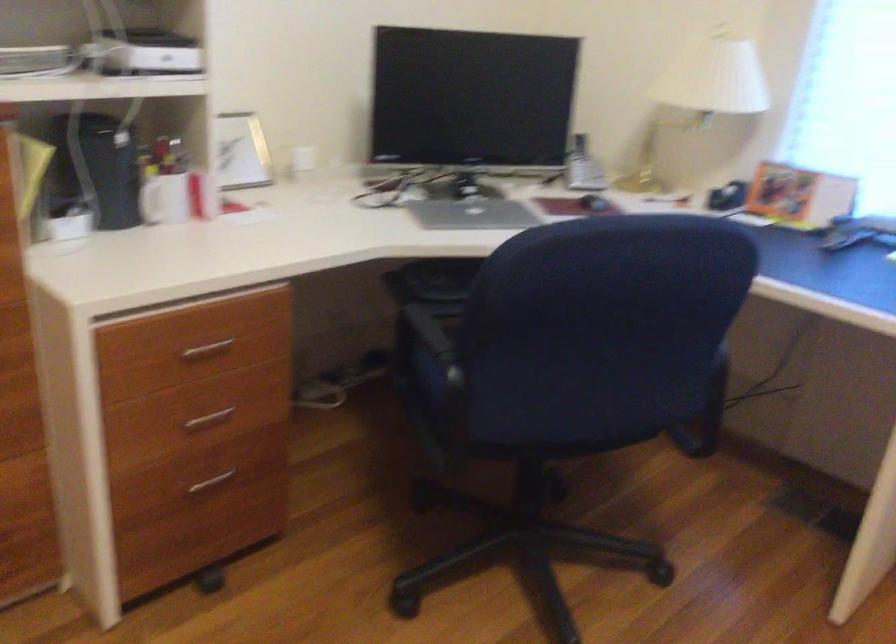
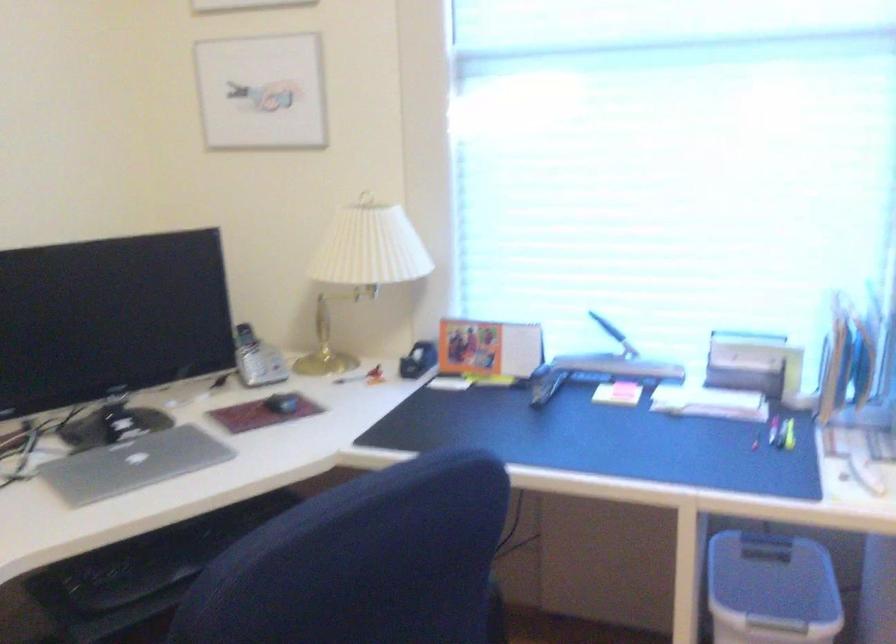
Where in the second image is the point corresponding to point 583,166 from the first image?

(256, 359)